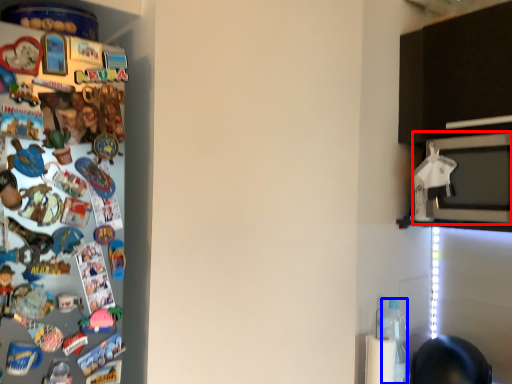
Question: Among these objects, which one is farthest to the camera, microwave oven (highlighted by a red box) or bottle (highlighted by a blue box)?

Choices:
 (A) microwave oven
 (B) bottle

Answer: (B)